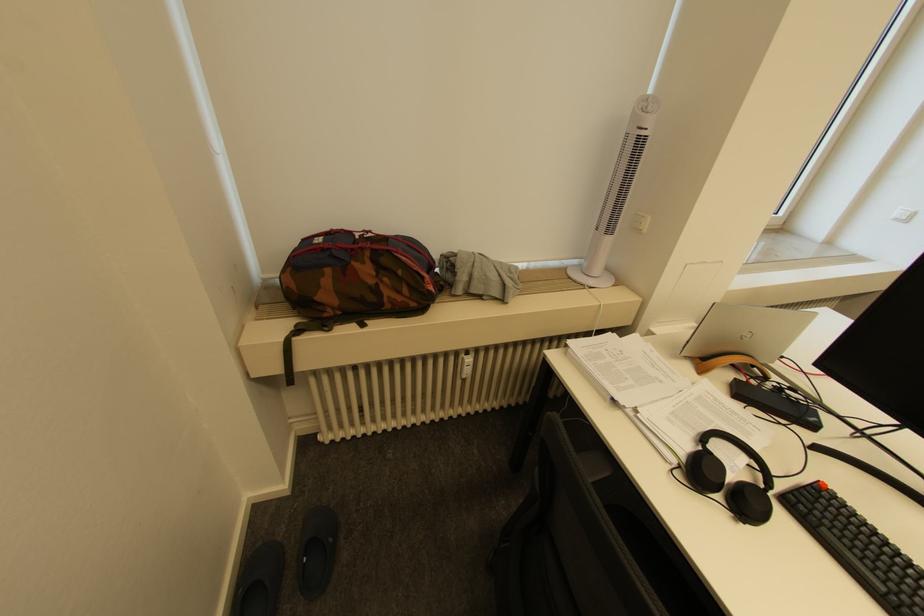
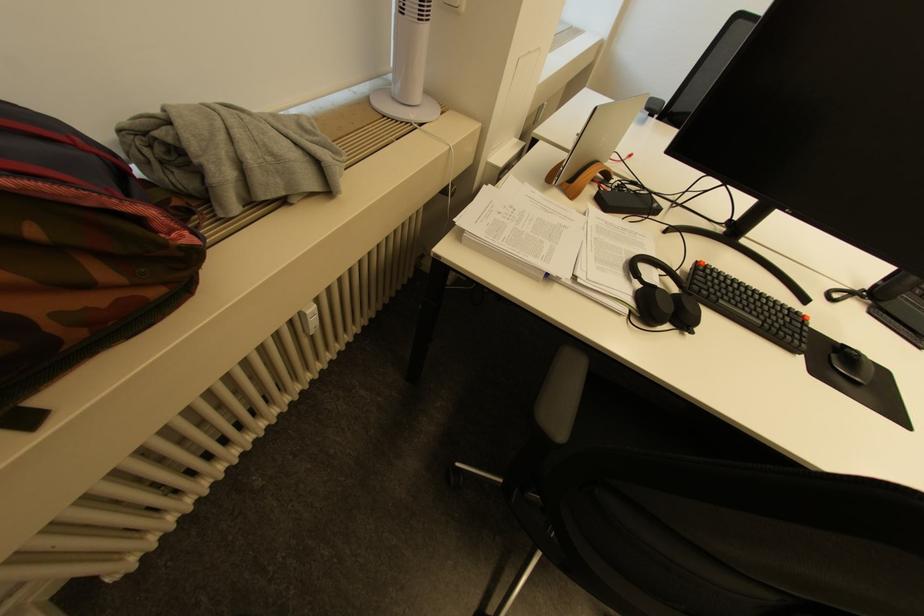
Find the pixel in the second image that matches the point at 706,355 in the first image.

(574, 177)